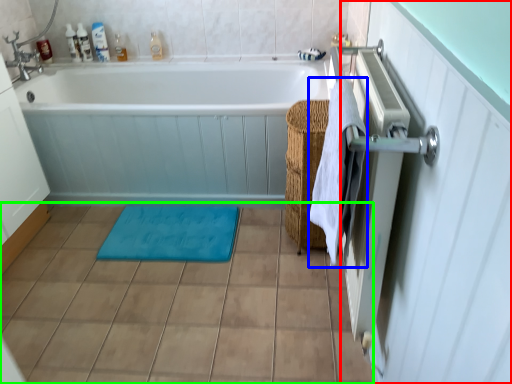
Question: Which object is positioned farthest from screen door (highlighted by a red box)? Select from beach towel (highlighted by a blue box) and ceramic tile (highlighted by a green box).

Choices:
 (A) beach towel
 (B) ceramic tile

Answer: (B)